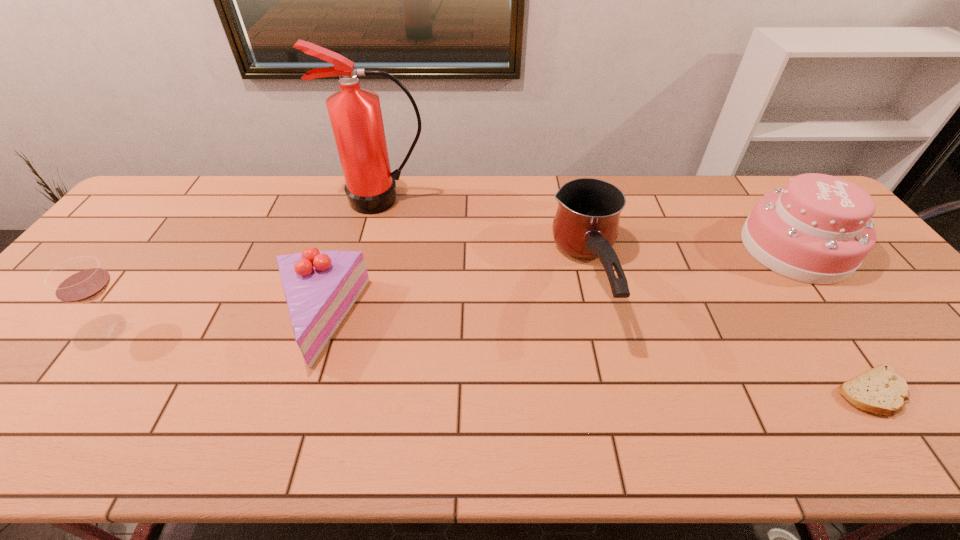
This screenshot has width=960, height=540. Identify the location of vacant space that's between the shortest object and the leftmost object. (495, 359).

Identify the location of object identified as the second closest to the taller cake. (586, 225).

Select which object appears as the second closest to the right cake. Please provide its 2D coordinates. Your answer should be formatted as a tuple, i.e. [(x, y)], where the tuple contains the x and y coordinates of a point satisfying the conditions above.

[(586, 225)]

You are a GUI agent. You are given a task and a screenshot of the screen. Output one action in this format:
    pyautogui.click(x=<x>, y=<y>)
    Task: Click on the free location that satisfies the following two spatial constraints: 1. on the back side of the taller cake; 2. on the right side of the second shortest object
    
    Given the screenshot: What is the action you would take?
    pyautogui.click(x=341, y=248)

Find the location of a particular element. The image size is (960, 540). vacant area that satisfies the following two spatial constraints: 1. at the spray nozzle of the shortest object; 2. on the left side of the tallest object is located at coordinates (334, 392).

This screenshot has width=960, height=540. What are the coordinates of `free space that satisfies the following two spatial constraints: 1. at the spray nozzle of the shortest object; 2. on the right side of the fire extinguisher` in the screenshot? It's located at (334, 392).

The height and width of the screenshot is (540, 960). I want to click on vacant space that satisfies the following two spatial constraints: 1. on the front side of the pita bread; 2. on the left side of the wineglass, so click(x=72, y=392).